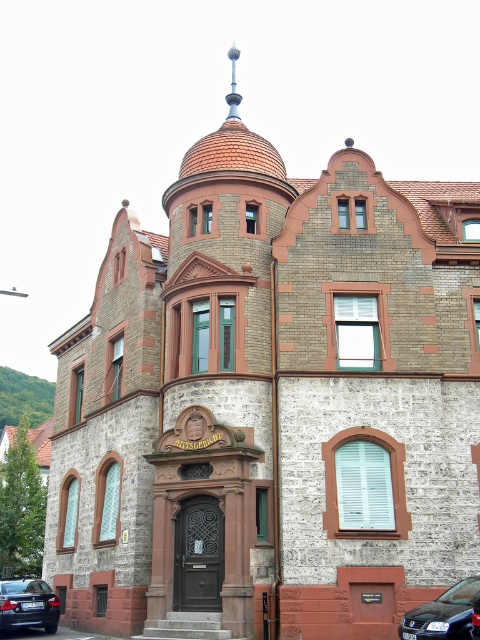
Question: Does black glossy car at lower right appear on the right side of black glossy car at lower left?

Choices:
 (A) yes
 (B) no

Answer: (A)

Question: Among these objects, which one is farthest from the camera?

Choices:
 (A) black glossy car at lower left
 (B) black glossy car at lower right

Answer: (A)

Question: Is black glossy car at lower right below black glossy car at lower left?

Choices:
 (A) yes
 (B) no

Answer: (B)

Question: Is black glossy car at lower right to the right of black glossy car at lower left from the viewer's perspective?

Choices:
 (A) no
 (B) yes

Answer: (B)

Question: Which of the following is the farthest from the observer?

Choices:
 (A) tap(8, 614)
 (B) tap(420, 612)

Answer: (A)